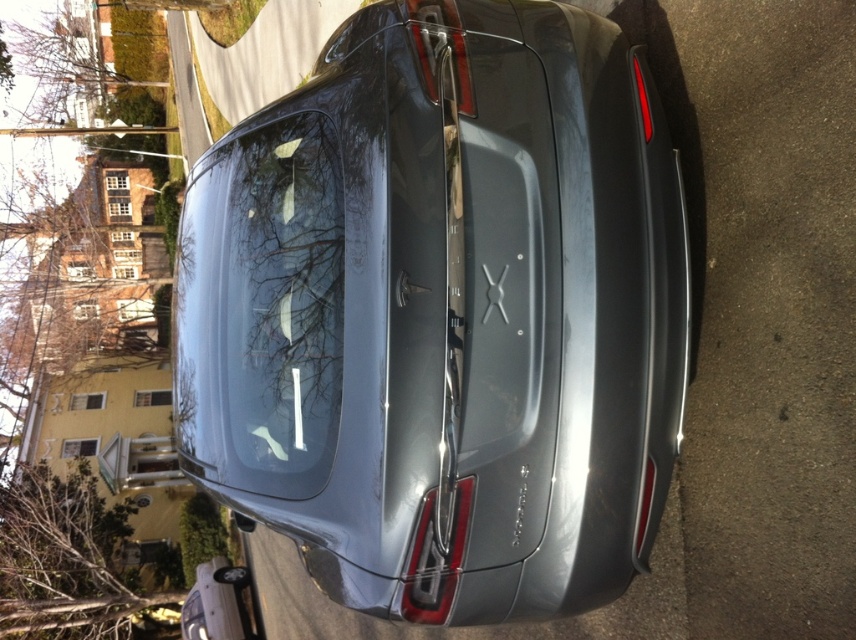
Based on the photo, you are standing on the sidewalk and see the satin metallic car at center and the transparent glass windshield at center. Which object is nearer to you?

The satin metallic car at center is closer to the viewer than the transparent glass windshield at center.